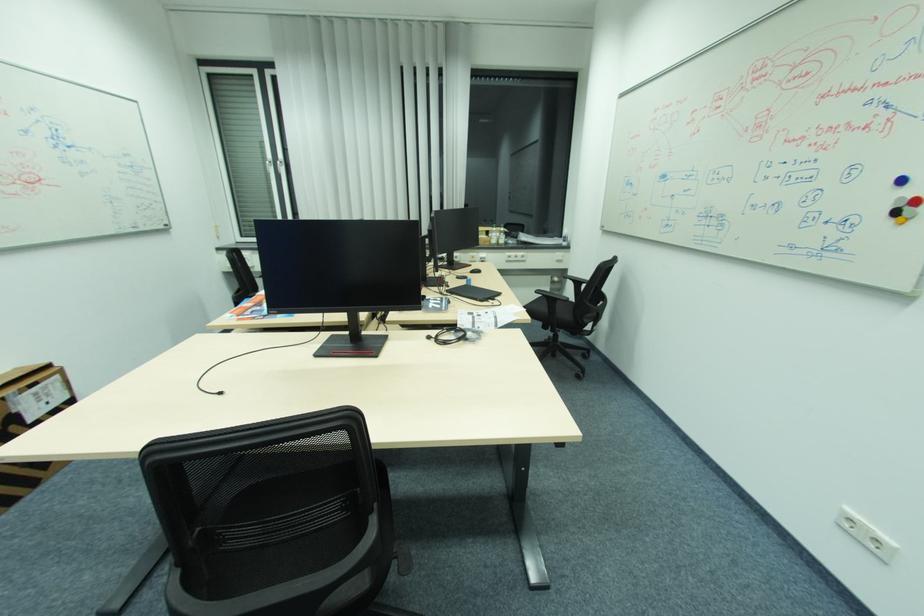
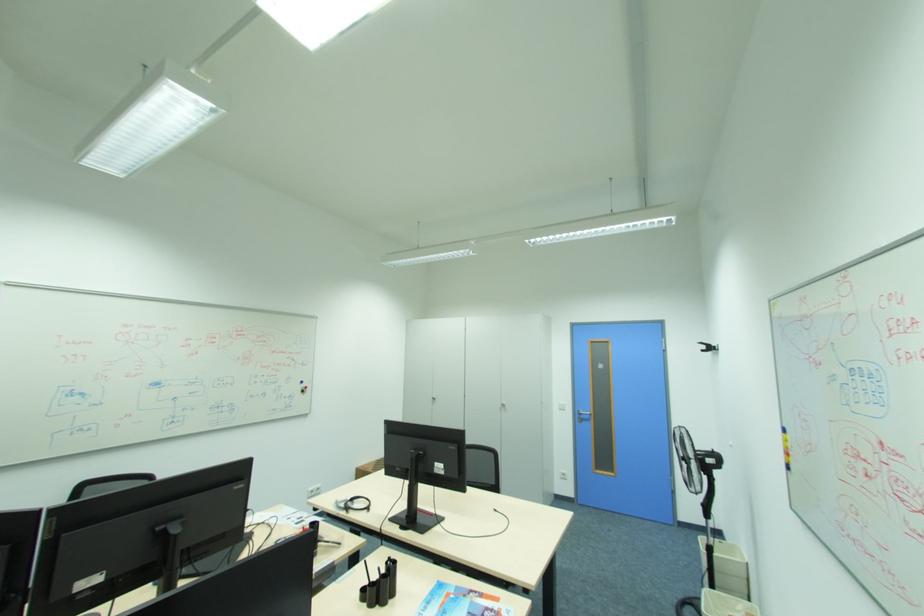
The point at (253, 315) is marked in the first image. Where is the corresponding point in the second image?

(492, 610)